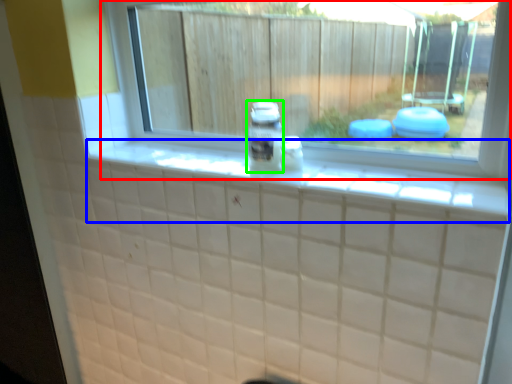
Question: Which object is positioned closest to window (highlighted by a red box)? Select from ledge (highlighted by a blue box) and glass jar (highlighted by a green box).

Choices:
 (A) ledge
 (B) glass jar

Answer: (B)